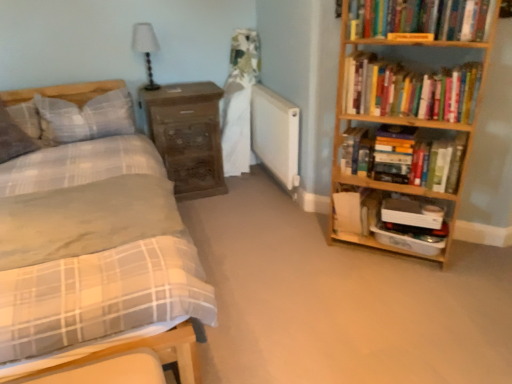
Question: Considering the relative sizes of plaid fabric pillow at left, which appears as the second pillow when viewed from the right, and hardcover books at right, which ranks as the first book in bottom-to-top order, in the image provided, is plaid fabric pillow at left, which appears as the second pillow when viewed from the right, bigger than hardcover books at right, which ranks as the first book in bottom-to-top order,?

Choices:
 (A) no
 (B) yes

Answer: (A)

Question: Is the position of plaid fabric pillow at left, which appears as the second pillow when viewed from the right, more distant than that of hardcover books at right, which ranks as the first book in bottom-to-top order?

Choices:
 (A) yes
 (B) no

Answer: (A)

Question: Can you confirm if plaid fabric pillow at left, the 1th pillow from the left, is positioned to the right of hardcover books at right, arranged as the 3th book when viewed from the top?

Choices:
 (A) no
 (B) yes

Answer: (A)

Question: From a real-world perspective, does plaid fabric pillow at left, which appears as the second pillow when viewed from the right, sit lower than hardcover books at right, which ranks as the first book in bottom-to-top order?

Choices:
 (A) no
 (B) yes

Answer: (A)

Question: From the image's perspective, is plaid fabric pillow at left, which appears as the second pillow when viewed from the right, beneath hardcover books at right, arranged as the 3th book when viewed from the top?

Choices:
 (A) no
 (B) yes

Answer: (A)

Question: In the image, is wooden bookcase at right positioned in front of or behind hardcover book at upper right, which is counted as the first paperback book, starting from the front?

Choices:
 (A) front
 (B) behind

Answer: (A)

Question: Looking at their shapes, would you say wooden bookcase at right is wider or thinner than hardcover book at upper right, which is counted as the first paperback book, starting from the front?

Choices:
 (A) thin
 (B) wide

Answer: (B)

Question: Considering the positions of point (374, 147) and point (407, 33), is point (374, 147) closer or farther from the camera than point (407, 33)?

Choices:
 (A) farther
 (B) closer

Answer: (A)

Question: From a real-world perspective, is wooden bookcase at right positioned above or below hardcover book at upper right, which appears as the 2th paperback book when viewed from the back?

Choices:
 (A) above
 (B) below

Answer: (B)

Question: From the image's perspective, is hardcover book at upper right, which is counted as the first paperback book, starting from the front, positioned above or below matte wooden bed at left?

Choices:
 (A) above
 (B) below

Answer: (A)

Question: Is hardcover book at upper right, arranged as the second paperback book when ordered from the bottom, to the left or to the right of matte wooden bed at left in the image?

Choices:
 (A) left
 (B) right

Answer: (B)

Question: Is hardcover book at upper right, which appears as the 2th paperback book when viewed from the back, wider or thinner than matte wooden bed at left?

Choices:
 (A) wide
 (B) thin

Answer: (B)

Question: Is hardcover book at upper right, arranged as the second paperback book when ordered from the bottom, taller or shorter than matte wooden bed at left?

Choices:
 (A) tall
 (B) short

Answer: (B)

Question: From a real-world perspective, is wooden bookcase at right positioned above or below plaid fabric pillow at left, which appears as the second pillow when viewed from the right?

Choices:
 (A) above
 (B) below

Answer: (B)

Question: From the image's perspective, is wooden bookcase at right located above or below plaid fabric pillow at left, which appears as the second pillow when viewed from the right?

Choices:
 (A) below
 (B) above

Answer: (A)